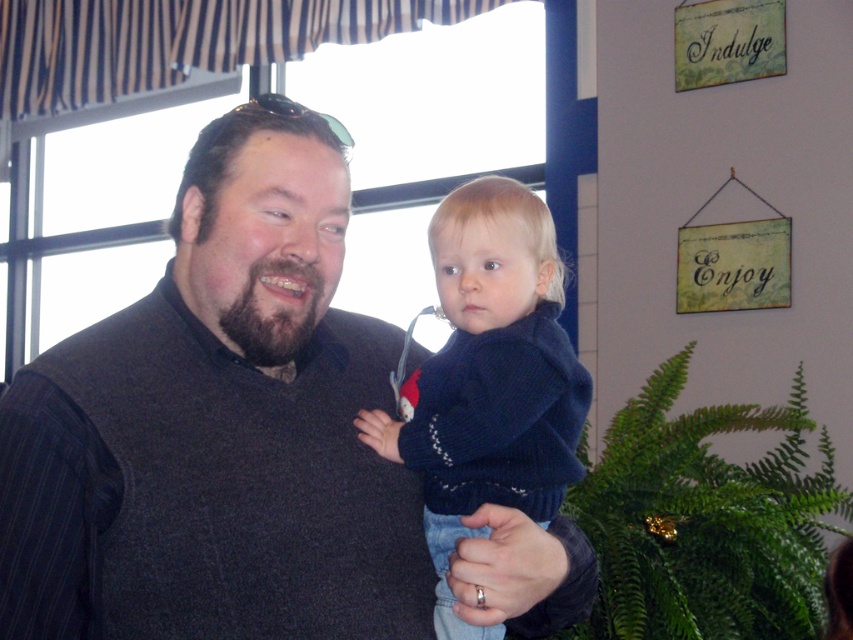
Question: Which point is farther to the camera?

Choices:
 (A) dark gray sweater at center
 (B) dark blue sweater at center

Answer: (B)

Question: Can you confirm if dark gray sweater at center is bigger than dark blue sweater at center?

Choices:
 (A) no
 (B) yes

Answer: (B)

Question: Among these points, which one is farthest from the camera?

Choices:
 (A) (514, 376)
 (B) (511, 620)

Answer: (A)

Question: Is dark gray sweater at center below dark blue sweater at center?

Choices:
 (A) no
 (B) yes

Answer: (B)

Question: Can you confirm if dark gray sweater at center is wider than dark blue sweater at center?

Choices:
 (A) no
 (B) yes

Answer: (B)